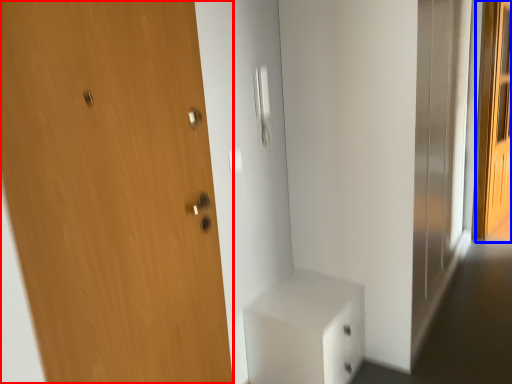
Question: Which object is closer to the camera taking this photo, door (highlighted by a red box) or screen door (highlighted by a blue box)?

Choices:
 (A) door
 (B) screen door

Answer: (A)